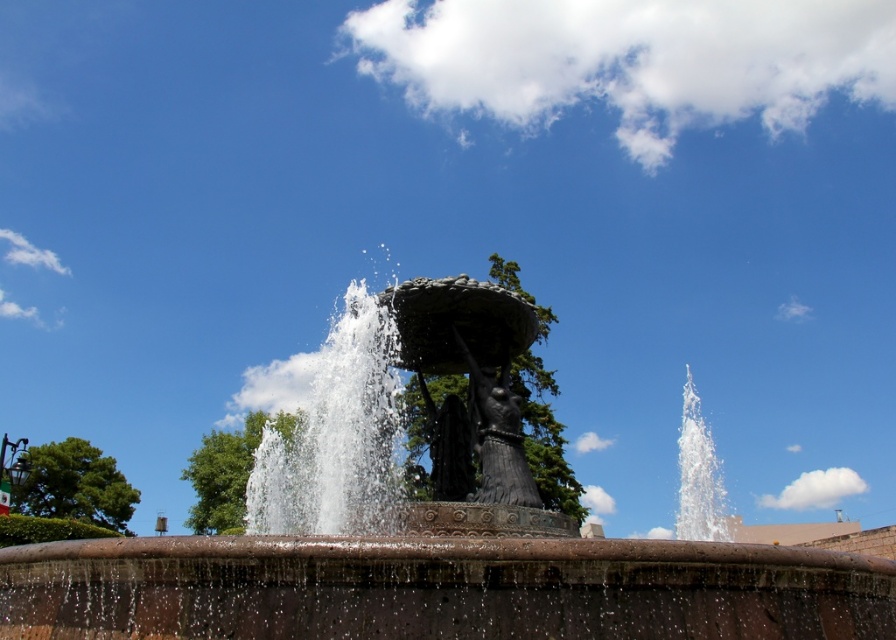
Question: Is bronze statue at center to the left of black polished stone statue at center from the viewer's perspective?

Choices:
 (A) yes
 (B) no

Answer: (B)

Question: Does bronze statue at center appear over black polished stone statue at center?

Choices:
 (A) no
 (B) yes

Answer: (A)

Question: Which of the following is the farthest from the observer?

Choices:
 (A) black polished stone statue at center
 (B) bronze statue at center

Answer: (A)

Question: Can you confirm if bronze statue at center is positioned to the left of black polished stone statue at center?

Choices:
 (A) yes
 (B) no

Answer: (B)

Question: Which of the following is the farthest from the observer?

Choices:
 (A) (277, 589)
 (B) (477, 417)

Answer: (B)